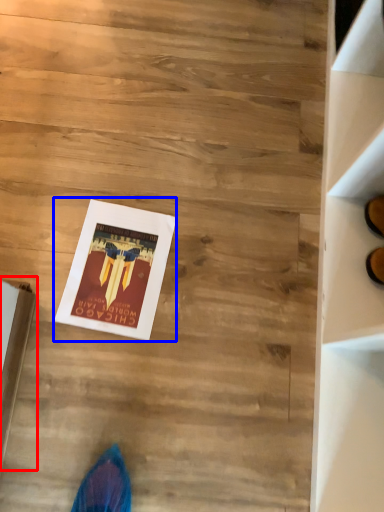
Question: Which object appears closest to the camera in this image, cardboard box (highlighted by a red box) or magazine (highlighted by a blue box)?

Choices:
 (A) cardboard box
 (B) magazine

Answer: (A)